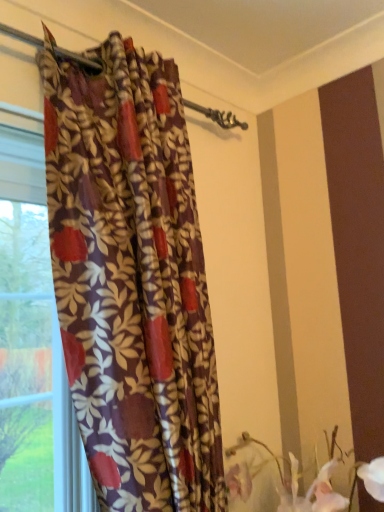
Question: From the image's perspective, relative to floral-patterned fabric curtain at left, is fluffy fabric flowers at lower right above or below?

Choices:
 (A) below
 (B) above

Answer: (A)

Question: Considering the positions of fluffy fabric flowers at lower right and floral-patterned fabric curtain at left in the image, is fluffy fabric flowers at lower right wider or thinner than floral-patterned fabric curtain at left?

Choices:
 (A) thin
 (B) wide

Answer: (B)

Question: Considering the positions of point (372, 489) and point (119, 316), is point (372, 489) closer or farther from the camera than point (119, 316)?

Choices:
 (A) closer
 (B) farther

Answer: (B)

Question: Is floral-patterned fabric curtain at left inside or outside of fluffy fabric flowers at lower right?

Choices:
 (A) outside
 (B) inside

Answer: (A)

Question: In terms of height, does floral-patterned fabric curtain at left look taller or shorter compared to fluffy fabric flowers at lower right?

Choices:
 (A) tall
 (B) short

Answer: (A)

Question: From the image's perspective, is floral-patterned fabric curtain at left above or below fluffy fabric flowers at lower right?

Choices:
 (A) below
 (B) above

Answer: (B)

Question: In the image, is floral-patterned fabric curtain at left positioned in front of or behind fluffy fabric flowers at lower right?

Choices:
 (A) behind
 (B) front

Answer: (B)